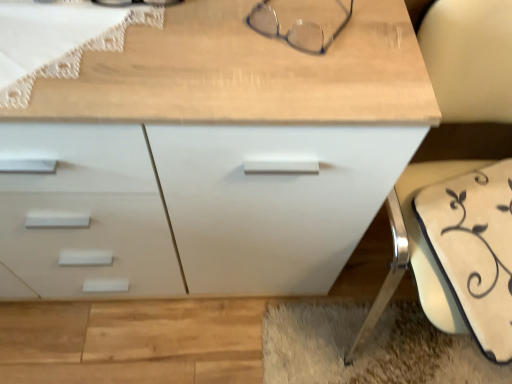
Question: Is white matte chest of drawers at center thinner than white fabric swivel chair at lower right?

Choices:
 (A) yes
 (B) no

Answer: (A)

Question: From the image's perspective, is white matte chest of drawers at center under white fabric swivel chair at lower right?

Choices:
 (A) yes
 (B) no

Answer: (B)

Question: Can you confirm if white matte chest of drawers at center is positioned to the left of white fabric swivel chair at lower right?

Choices:
 (A) no
 (B) yes

Answer: (B)

Question: Considering the relative positions of white matte chest of drawers at center and white fabric swivel chair at lower right in the image provided, is white matte chest of drawers at center in front of white fabric swivel chair at lower right?

Choices:
 (A) yes
 (B) no

Answer: (B)

Question: From the image's perspective, would you say white matte chest of drawers at center is positioned over white fabric swivel chair at lower right?

Choices:
 (A) no
 (B) yes

Answer: (B)

Question: Is white fabric swivel chair at lower right a part of white matte chest of drawers at center?

Choices:
 (A) no
 (B) yes

Answer: (A)

Question: Can you confirm if clear plastic glasses at upper center is positioned to the right of white matte chest of drawers at center?

Choices:
 (A) yes
 (B) no

Answer: (A)

Question: Can you confirm if clear plastic glasses at upper center is shorter than white matte chest of drawers at center?

Choices:
 (A) no
 (B) yes

Answer: (B)

Question: Is the position of clear plastic glasses at upper center more distant than that of white matte chest of drawers at center?

Choices:
 (A) yes
 (B) no

Answer: (A)

Question: Can you confirm if clear plastic glasses at upper center is smaller than white matte chest of drawers at center?

Choices:
 (A) yes
 (B) no

Answer: (A)

Question: Is clear plastic glasses at upper center oriented away from white matte chest of drawers at center?

Choices:
 (A) yes
 (B) no

Answer: (B)

Question: Considering the relative sizes of clear plastic glasses at upper center and white matte chest of drawers at center in the image provided, is clear plastic glasses at upper center taller than white matte chest of drawers at center?

Choices:
 (A) yes
 (B) no

Answer: (B)

Question: Is white matte chest of drawers at center shorter than clear plastic glasses at upper center?

Choices:
 (A) no
 (B) yes

Answer: (A)